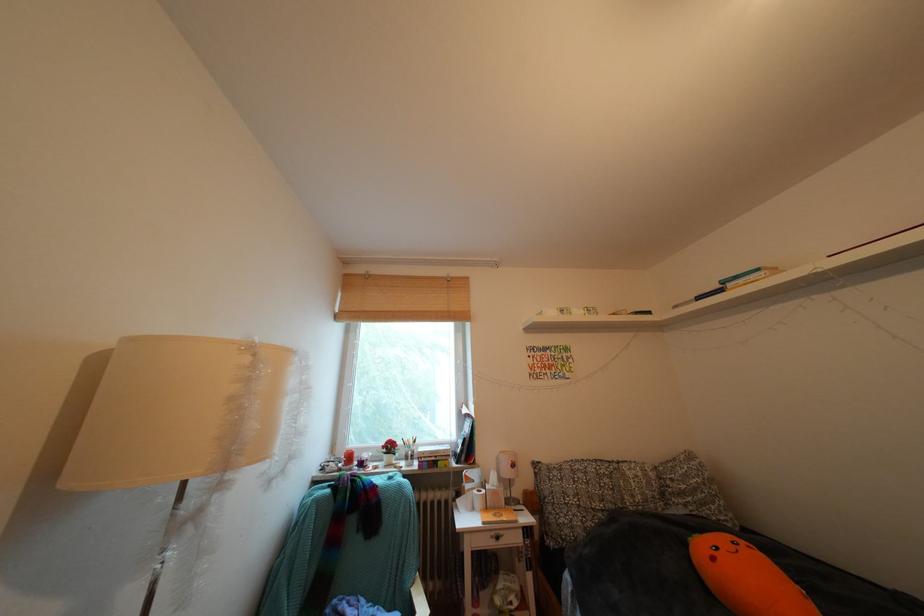
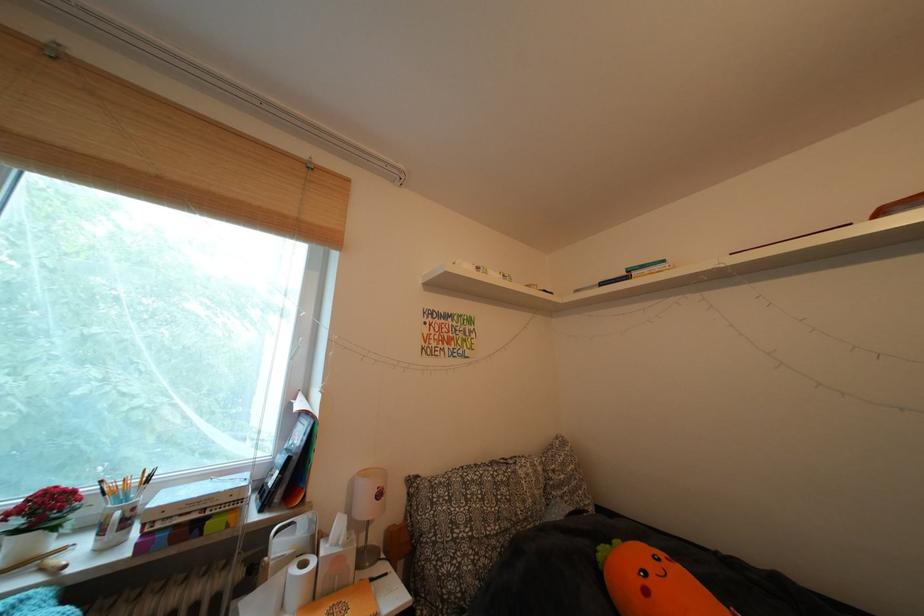
Question: The camera is either moving clockwise (left) or counter-clockwise (right) around the object. The first image is from the beginning of the video and the second image is from the end. Is the camera moving left or right when shooting the video?

Choices:
 (A) Left
 (B) Right

Answer: (A)